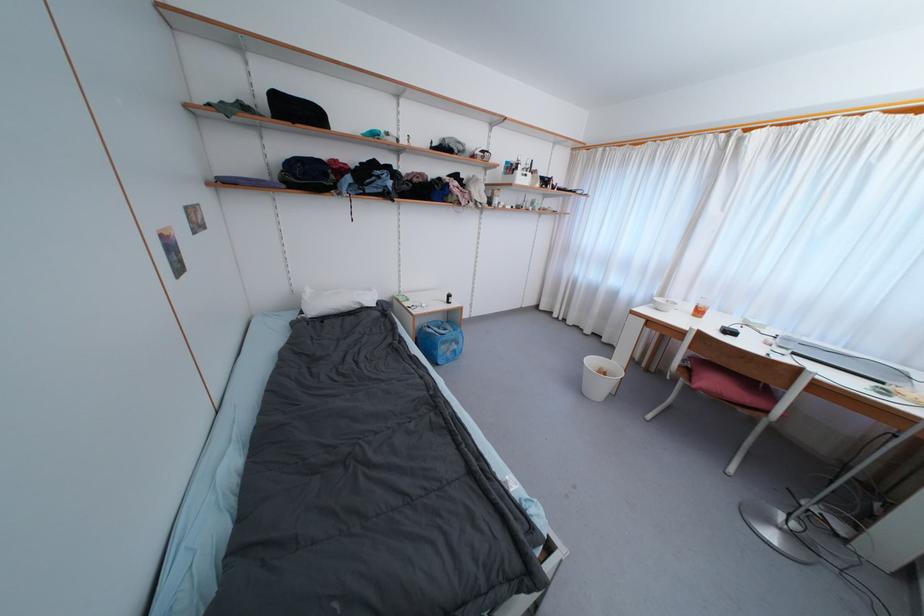
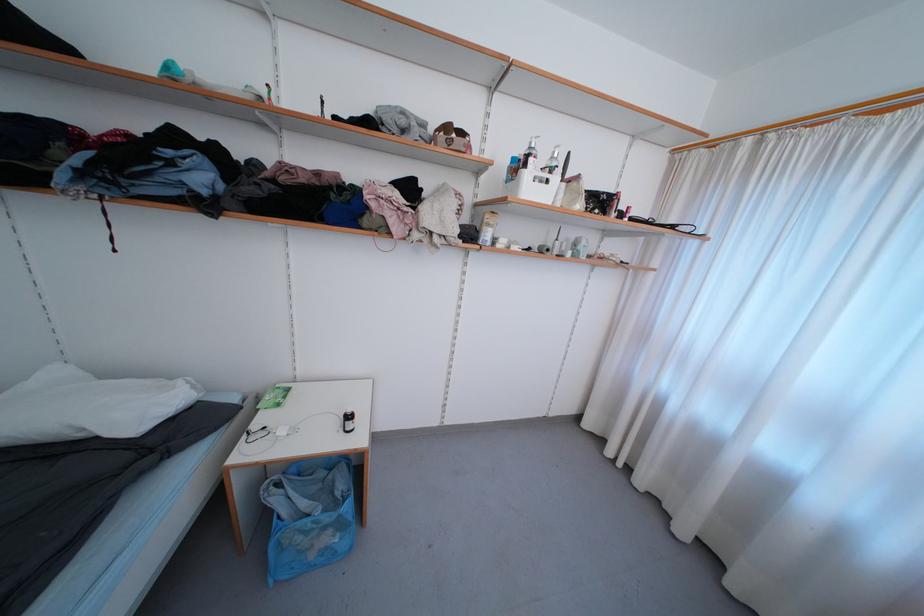
The point at (432,330) is marked in the first image. Where is the corresponding point in the second image?

(284, 488)